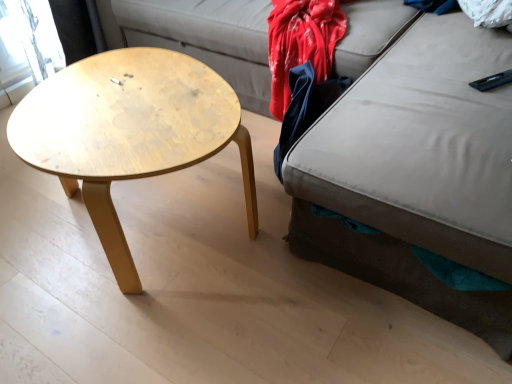
Question: Is natural wood coffee table at left smaller than dark blue fabric at right?

Choices:
 (A) no
 (B) yes

Answer: (A)

Question: Is natural wood coffee table at left taller than dark blue fabric at right?

Choices:
 (A) no
 (B) yes

Answer: (B)

Question: Are natural wood coffee table at left and dark blue fabric at right located far from each other?

Choices:
 (A) yes
 (B) no

Answer: (B)

Question: Is the surface of natural wood coffee table at left in direct contact with dark blue fabric at right?

Choices:
 (A) yes
 (B) no

Answer: (B)

Question: Does natural wood coffee table at left have a lesser width compared to dark blue fabric at right?

Choices:
 (A) yes
 (B) no

Answer: (B)

Question: Can you confirm if natural wood coffee table at left is positioned to the right of dark blue fabric at right?

Choices:
 (A) yes
 (B) no

Answer: (B)

Question: From a real-world perspective, is dark blue fabric at right beneath natural wood coffee table at left?

Choices:
 (A) yes
 (B) no

Answer: (A)

Question: Is dark blue fabric at right to the right of natural wood coffee table at left from the viewer's perspective?

Choices:
 (A) yes
 (B) no

Answer: (A)

Question: Can you confirm if dark blue fabric at right is thinner than natural wood coffee table at left?

Choices:
 (A) yes
 (B) no

Answer: (A)

Question: Does dark blue fabric at right come behind natural wood coffee table at left?

Choices:
 (A) yes
 (B) no

Answer: (A)

Question: Are dark blue fabric at right and natural wood coffee table at left beside each other?

Choices:
 (A) yes
 (B) no

Answer: (B)

Question: Is dark blue fabric at right closer to the viewer compared to natural wood coffee table at left?

Choices:
 (A) no
 (B) yes

Answer: (A)

Question: From the image's perspective, is dark blue fabric at right located above or below natural wood coffee table at left?

Choices:
 (A) above
 (B) below

Answer: (A)